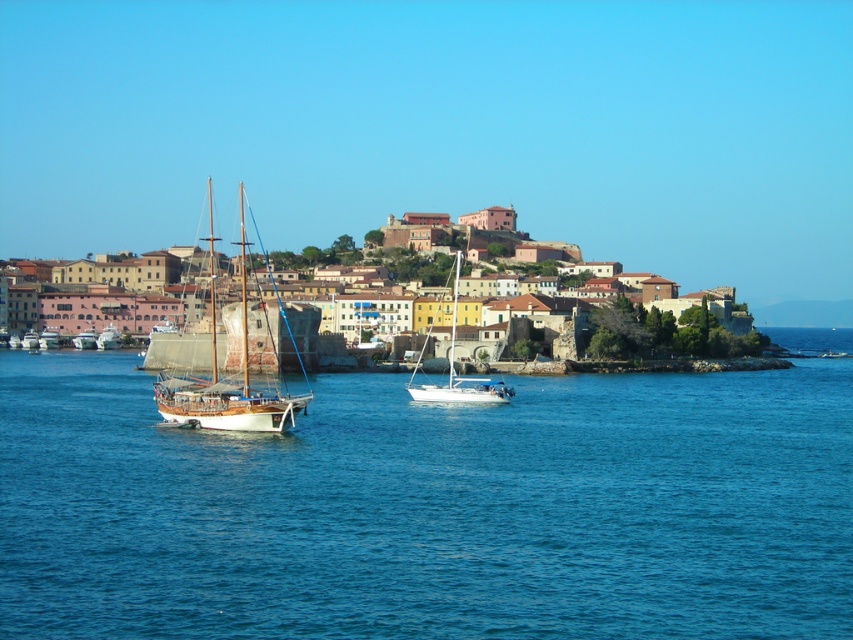
Question: Which object appears closest to the camera in this image?

Choices:
 (A) brick stone buildings at center
 (B) blue water at center

Answer: (B)

Question: Can you confirm if wooden polished sailboat at left is positioned below white glossy sailboat at center?

Choices:
 (A) yes
 (B) no

Answer: (B)

Question: Does blue water at center appear under wooden polished sailboat at left?

Choices:
 (A) no
 (B) yes

Answer: (B)

Question: Which point appears farthest from the camera in this image?

Choices:
 (A) (94, 520)
 (B) (289, 403)
 (C) (456, 266)
 (D) (654, 339)

Answer: (C)

Question: Is wooden polished sailboat at left to the left of white glossy sailboat at center from the viewer's perspective?

Choices:
 (A) no
 (B) yes

Answer: (B)

Question: Which point is closer to the camera?

Choices:
 (A) wooden polished sailboat at left
 (B) white glossy sailboat at center
 (C) blue water at center
 (D) brick stone buildings at center

Answer: (C)